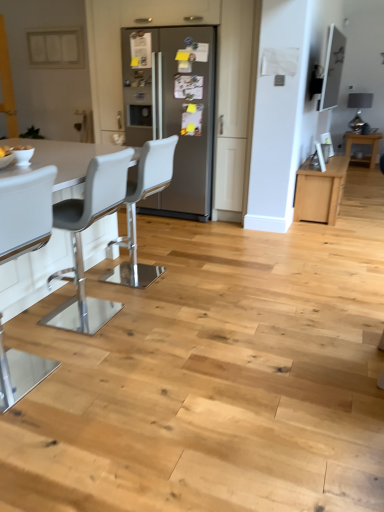
Question: Can you confirm if white plastic chair at left, arranged as the 1th chair when viewed from the front, is smaller than white plastic chair at center, marked as the first chair in a back-to-front arrangement?

Choices:
 (A) no
 (B) yes

Answer: (B)

Question: Is white plastic chair at left, positioned as the 3th chair in back-to-front order, aimed at white plastic chair at center, marked as the first chair in a back-to-front arrangement?

Choices:
 (A) yes
 (B) no

Answer: (B)

Question: From a real-world perspective, does white plastic chair at left, arranged as the 1th chair when viewed from the front, sit lower than white plastic chair at center, positioned as the third chair in front-to-back order?

Choices:
 (A) yes
 (B) no

Answer: (B)

Question: From the image's perspective, does white plastic chair at left, positioned as the 3th chair in back-to-front order, appear lower than white plastic chair at center, marked as the first chair in a back-to-front arrangement?

Choices:
 (A) no
 (B) yes

Answer: (B)

Question: From a real-world perspective, is white plastic chair at left, positioned as the 3th chair in back-to-front order, on top of white plastic chair at center, marked as the first chair in a back-to-front arrangement?

Choices:
 (A) no
 (B) yes

Answer: (B)

Question: From a real-world perspective, is white plastic chair at center, positioned as the third chair in front-to-back order, positioned above or below white plastic chair at left, positioned as the 3th chair in back-to-front order?

Choices:
 (A) above
 (B) below

Answer: (B)

Question: Is white plastic chair at center, positioned as the third chair in front-to-back order, taller or shorter than white plastic chair at left, arranged as the 1th chair when viewed from the front?

Choices:
 (A) short
 (B) tall

Answer: (B)

Question: Based on their sizes in the image, would you say white plastic chair at center, positioned as the third chair in front-to-back order, is bigger or smaller than white plastic chair at left, arranged as the 1th chair when viewed from the front?

Choices:
 (A) small
 (B) big

Answer: (B)

Question: From the image's perspective, is white plastic chair at center, positioned as the third chair in front-to-back order, above or below white plastic chair at left, positioned as the 3th chair in back-to-front order?

Choices:
 (A) above
 (B) below

Answer: (A)

Question: From the image's perspective, relative to white leather bar stool at left, which is the 2th chair from front to back, is satin silver refrigerator at center above or below?

Choices:
 (A) above
 (B) below

Answer: (A)

Question: Looking at the image, does satin silver refrigerator at center seem bigger or smaller compared to white leather bar stool at left, which is the 2th chair from front to back?

Choices:
 (A) small
 (B) big

Answer: (B)

Question: From a real-world perspective, is satin silver refrigerator at center positioned above or below white leather bar stool at left, the second chair viewed from the back?

Choices:
 (A) below
 (B) above

Answer: (B)

Question: Is satin silver refrigerator at center inside or outside of white leather bar stool at left, the second chair viewed from the back?

Choices:
 (A) outside
 (B) inside

Answer: (A)

Question: Visually, is satin silver refrigerator at center positioned to the left or to the right of white plastic chair at left, positioned as the 3th chair in back-to-front order?

Choices:
 (A) left
 (B) right

Answer: (B)

Question: Looking at their shapes, would you say satin silver refrigerator at center is wider or thinner than white plastic chair at left, arranged as the 1th chair when viewed from the front?

Choices:
 (A) thin
 (B) wide

Answer: (B)